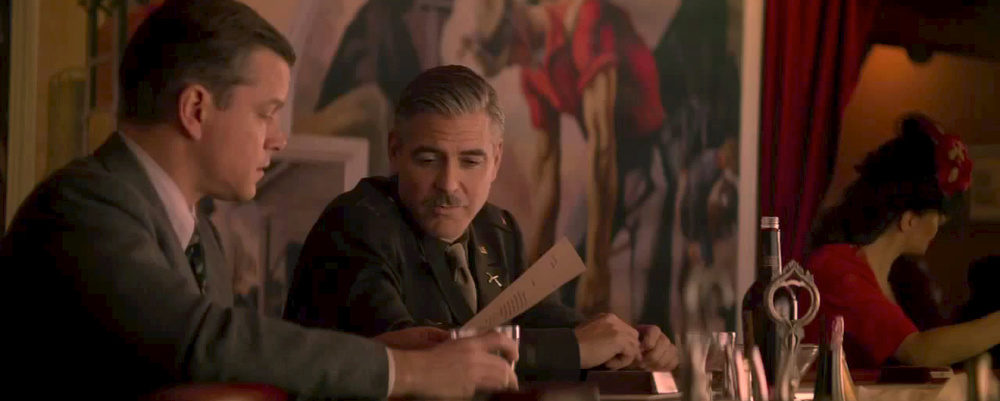
The image size is (1000, 401). In order to click on wine bottle in this screenshot , I will do `click(755, 317)`, `click(834, 354)`.